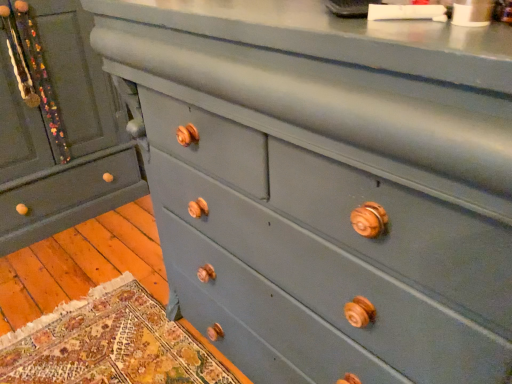
The image size is (512, 384). I want to click on matte gray dresser at left, so click(60, 130).

This screenshot has width=512, height=384. Describe the element at coordinates (60, 130) in the screenshot. I see `matte gray dresser at left` at that location.

Locate an element on the screen. The width and height of the screenshot is (512, 384). matte gray dresser at left is located at coordinates (60, 130).